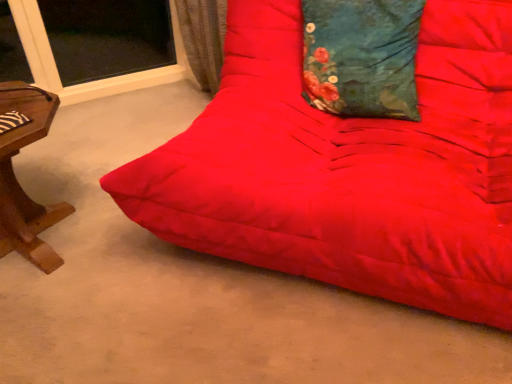
Question: From the image's perspective, relative to matte red futon at center, is teal floral fabric pillow at upper center above or below?

Choices:
 (A) above
 (B) below

Answer: (A)

Question: In terms of height, does teal floral fabric pillow at upper center look taller or shorter compared to matte red futon at center?

Choices:
 (A) short
 (B) tall

Answer: (A)

Question: Considering the positions of point (373, 74) and point (425, 117), is point (373, 74) closer or farther from the camera than point (425, 117)?

Choices:
 (A) closer
 (B) farther

Answer: (A)

Question: Considering the positions of matte red futon at center and teal floral fabric pillow at upper center in the image, is matte red futon at center taller or shorter than teal floral fabric pillow at upper center?

Choices:
 (A) short
 (B) tall

Answer: (B)

Question: Is matte red futon at center wider or thinner than teal floral fabric pillow at upper center?

Choices:
 (A) thin
 (B) wide

Answer: (B)

Question: Would you say matte red futon at center is to the left or to the right of teal floral fabric pillow at upper center in the picture?

Choices:
 (A) left
 (B) right

Answer: (A)

Question: Looking at the image, does matte red futon at center seem bigger or smaller compared to teal floral fabric pillow at upper center?

Choices:
 (A) big
 (B) small

Answer: (A)